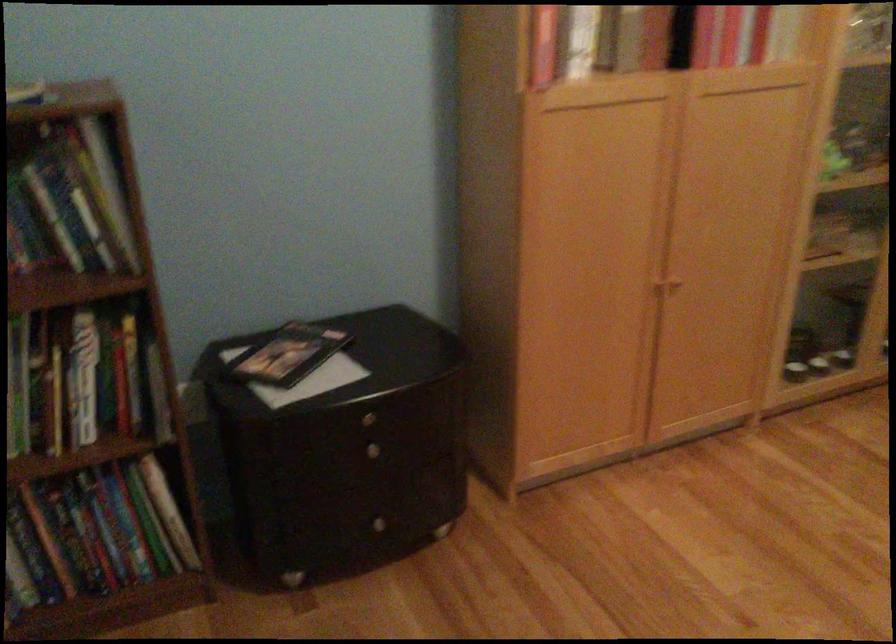
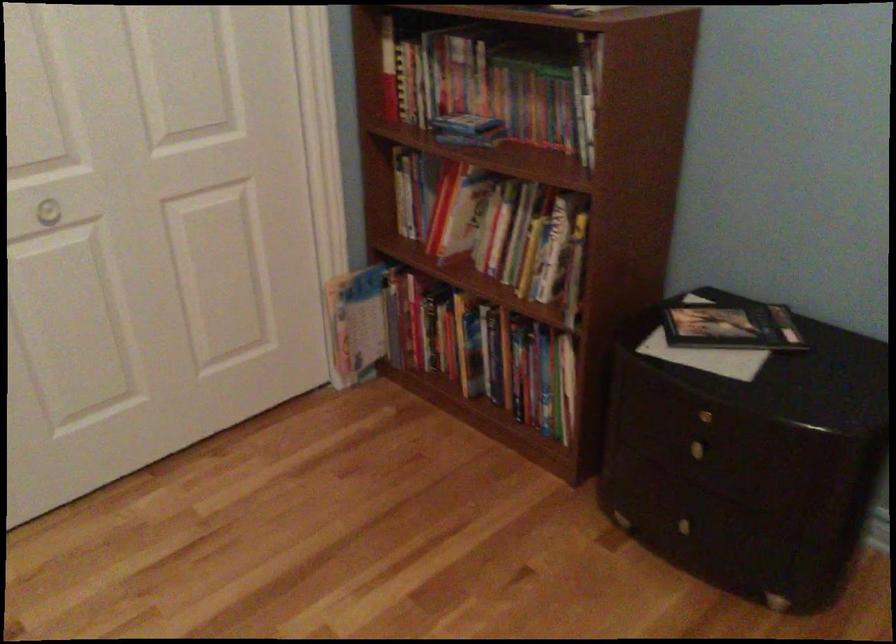
Where in the second image is the point corresponding to pixel 380 516 from the first image?

(690, 518)